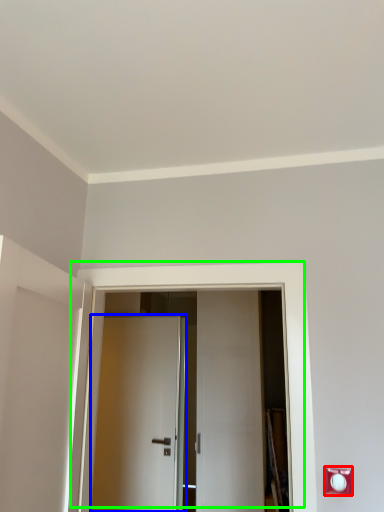
Question: Estimate the real-world distances between objects in this image. Which object is closer to electric outlet (highlighted by a red box), door (highlighted by a blue box) or door (highlighted by a green box)?

Choices:
 (A) door
 (B) door

Answer: (B)